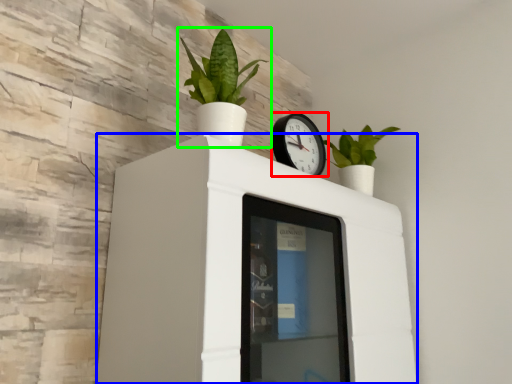
Question: Which is nearer to the wall clock (highlighted by a red box)? furniture (highlighted by a blue box) or houseplant (highlighted by a green box).

Choices:
 (A) furniture
 (B) houseplant

Answer: (B)